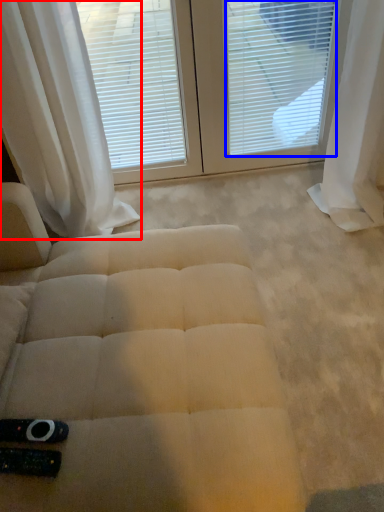
Question: Which object is further to the camera taking this photo, curtain (highlighted by a red box) or blind (highlighted by a blue box)?

Choices:
 (A) curtain
 (B) blind

Answer: (B)